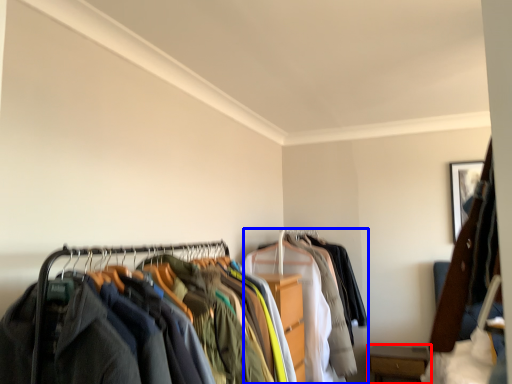
Question: Which object is further to the camera taking this photo, furniture (highlighted by a red box) or garment (highlighted by a blue box)?

Choices:
 (A) furniture
 (B) garment

Answer: (A)